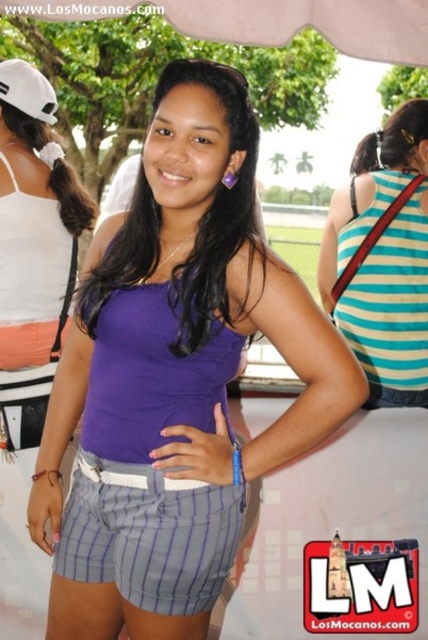
You are a fashion designer analyzing the outfit of the woman in the image. Which item of clothing, the purple fabric skirt at lower left or the purple matte tank top at center, has a greater height measurement?

The purple fabric skirt at lower left is much taller than the purple matte tank top at center, so the skirt has a greater height measurement.

Based on the photo, you are a photographer at a social event. You want to capture a photo of the striped fabric tank top at center and the white matte baseball cap at upper left in the same frame. The minimum distance your camera can focus on two objects simultaneously is 4 feet. Can you take the photo without moving either object?

The striped fabric tank top at center is 4.21 feet from the white matte baseball cap at upper left. Since the distance between them is slightly more than 4 feet, the camera might have difficulty focusing on both objects simultaneously without adjusting the focus or moving closer.